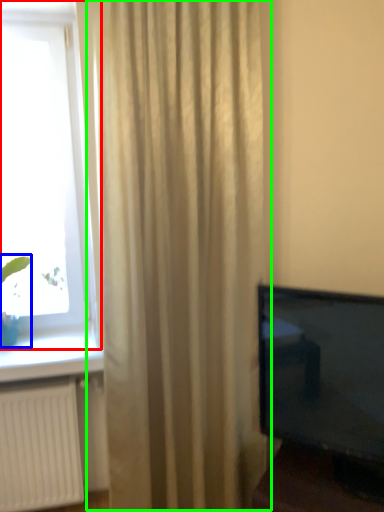
Question: Considering the real-world distances, which object is farthest from window (highlighted by a red box)? plant (highlighted by a blue box) or curtain (highlighted by a green box)?

Choices:
 (A) plant
 (B) curtain

Answer: (A)